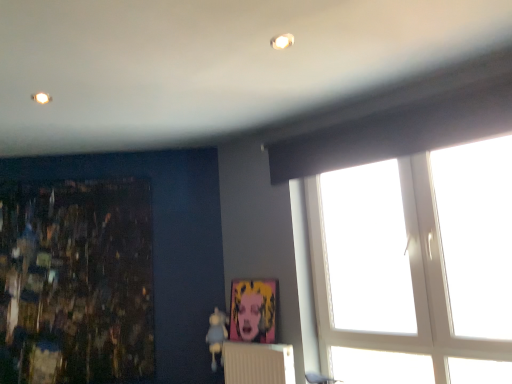
Question: Considering the relative sizes of dark textured painting at left and matte plastic picture frame at center in the image provided, is dark textured painting at left wider than matte plastic picture frame at center?

Choices:
 (A) no
 (B) yes

Answer: (A)

Question: From the image's perspective, is dark textured painting at left on matte plastic picture frame at center?

Choices:
 (A) no
 (B) yes

Answer: (B)

Question: Is there a large distance between dark textured painting at left and matte plastic picture frame at center?

Choices:
 (A) no
 (B) yes

Answer: (A)

Question: Is dark textured painting at left bigger than matte plastic picture frame at center?

Choices:
 (A) no
 (B) yes

Answer: (B)

Question: Considering the relative sizes of dark textured painting at left and matte plastic picture frame at center in the image provided, is dark textured painting at left shorter than matte plastic picture frame at center?

Choices:
 (A) yes
 (B) no

Answer: (B)

Question: From the image's perspective, is matte plastic picture frame at center above or below dark textured painting at left?

Choices:
 (A) below
 (B) above

Answer: (A)

Question: Visually, is matte plastic picture frame at center positioned to the left or to the right of dark textured painting at left?

Choices:
 (A) right
 (B) left

Answer: (A)

Question: Based on their sizes in the image, would you say matte plastic picture frame at center is bigger or smaller than dark textured painting at left?

Choices:
 (A) big
 (B) small

Answer: (B)

Question: From their relative heights in the image, would you say matte plastic picture frame at center is taller or shorter than dark textured painting at left?

Choices:
 (A) short
 (B) tall

Answer: (A)

Question: Would you say white plastic window at upper right is inside or outside white textured radiator at lower center?

Choices:
 (A) inside
 (B) outside

Answer: (B)

Question: Based on their positions, is white plastic window at upper right located to the left or right of white textured radiator at lower center?

Choices:
 (A) left
 (B) right

Answer: (B)

Question: From their relative heights in the image, would you say white plastic window at upper right is taller or shorter than white textured radiator at lower center?

Choices:
 (A) tall
 (B) short

Answer: (A)

Question: Is white plastic window at upper right wider or thinner than white textured radiator at lower center?

Choices:
 (A) thin
 (B) wide

Answer: (B)

Question: From the image's perspective, is white textured radiator at lower center positioned above or below matte plastic picture frame at center?

Choices:
 (A) above
 (B) below

Answer: (B)

Question: Is point (233, 354) closer or farther from the camera than point (269, 289)?

Choices:
 (A) farther
 (B) closer

Answer: (B)